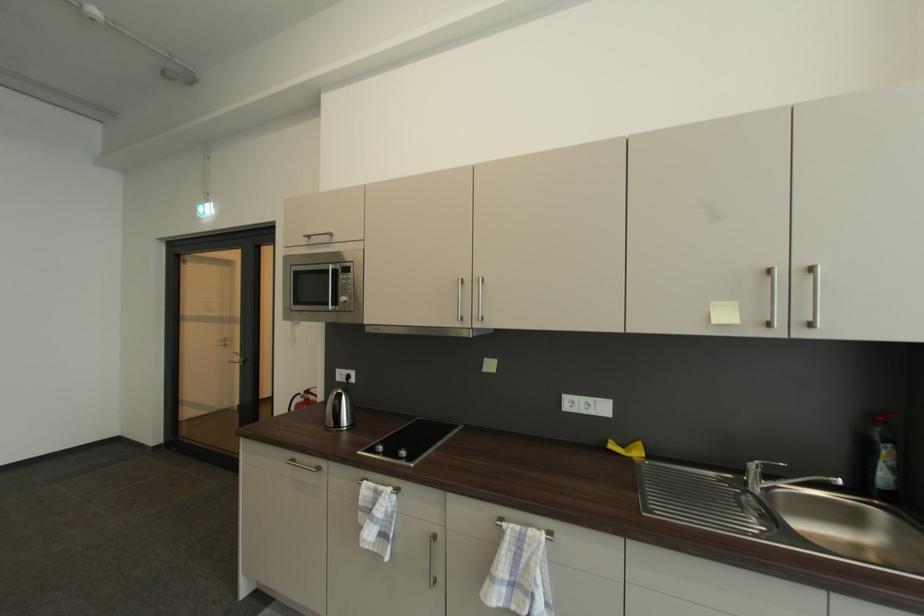
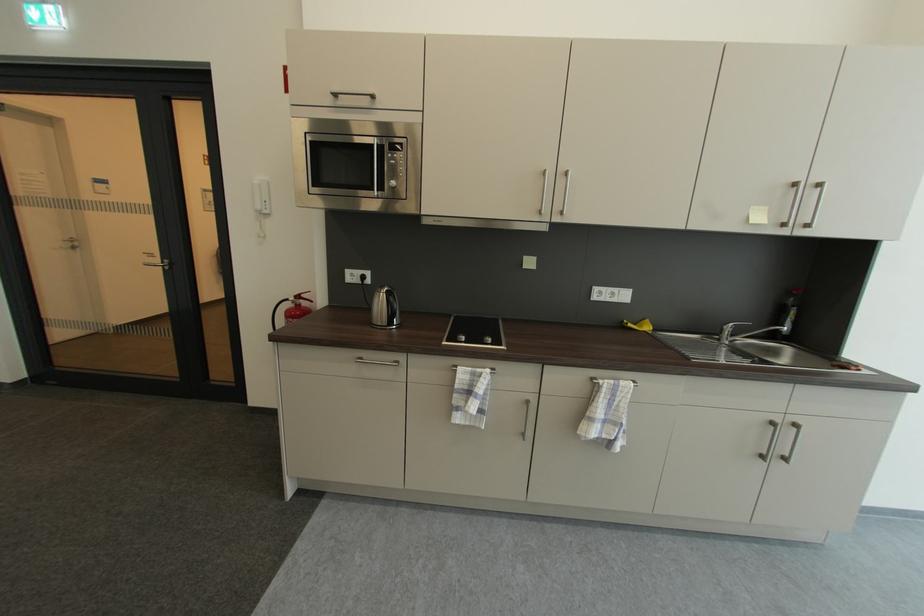
The point at (314,392) is marked in the first image. Where is the corresponding point in the second image?

(305, 299)